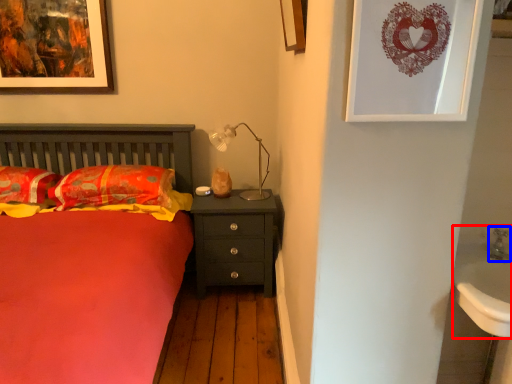
Question: Which point is closer to the camera, sink (highlighted by a red box) or faucet (highlighted by a blue box)?

Choices:
 (A) sink
 (B) faucet

Answer: (A)